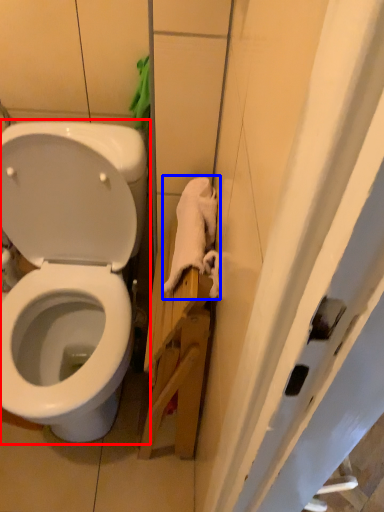
Question: Which object is further to the camera taking this photo, toilet (highlighted by a red box) or material (highlighted by a blue box)?

Choices:
 (A) toilet
 (B) material

Answer: (B)